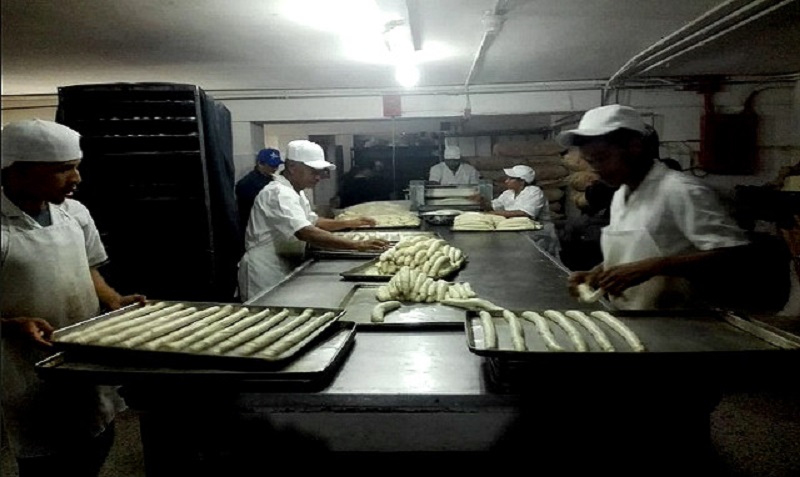
Identify the location of tray. The height and width of the screenshot is (477, 800). (362, 271).